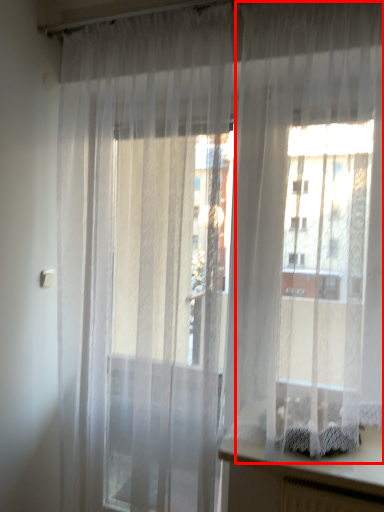
Question: Observing the image, what is the correct spatial positioning of curtain (annotated by the red box) in reference to vanity?

Choices:
 (A) left
 (B) right

Answer: (A)